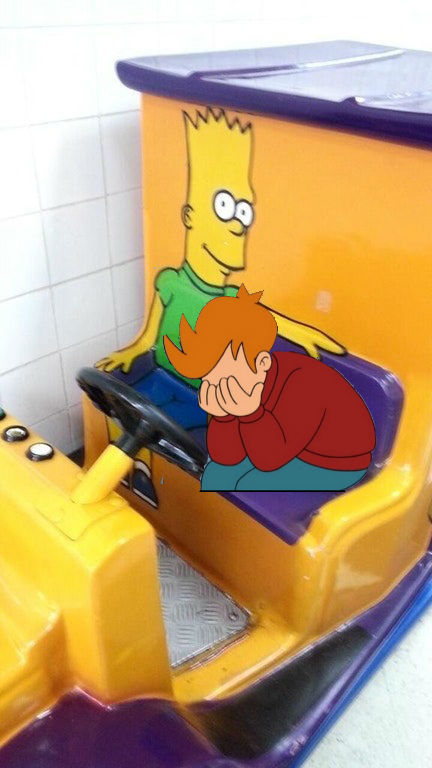
Find the location of a particular element. This screenshot has height=768, width=432. silver floorboard is located at coordinates (196, 603).